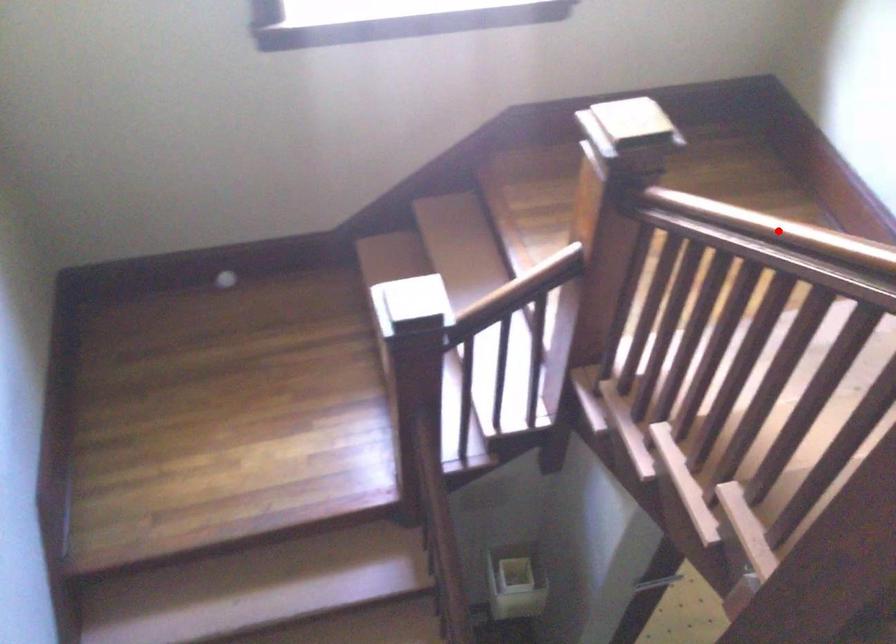
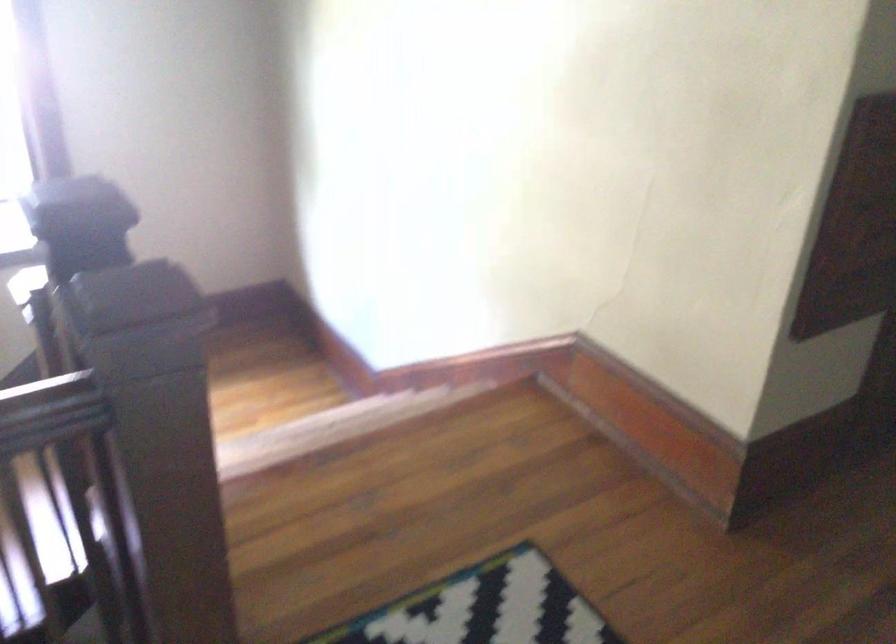
Question: I am providing you with two images of the same scene from different viewpoints. A red point is marked on the first image. Can you still see the location of the red point in image 2?

Choices:
 (A) Yes
 (B) No

Answer: (B)